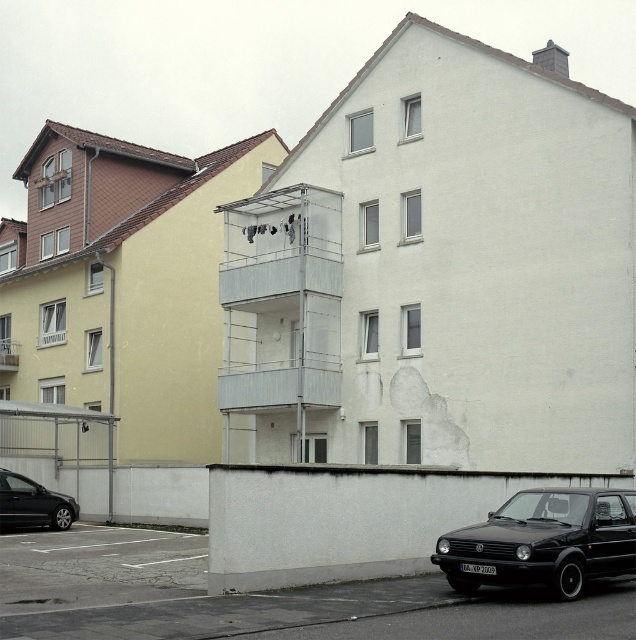
You are driving a delivery van that is 6 meters long. You need to park your van between the black matte hatchback at lower right and the black matte car at lower left. Is there enough space between them to park your van?

The distance between the black matte hatchback at lower right and the black matte car at lower left is 15.30 meters. Since your van is 6 meters long, there is sufficient space to park it between them.

You are standing at the point with coordinates point (24, 524) and want to look towards the point with coordinates point (626, 513). Will the building on the right block your view?

Point (626, 513) is in front of point (24, 524), so the building on the right will block your view.